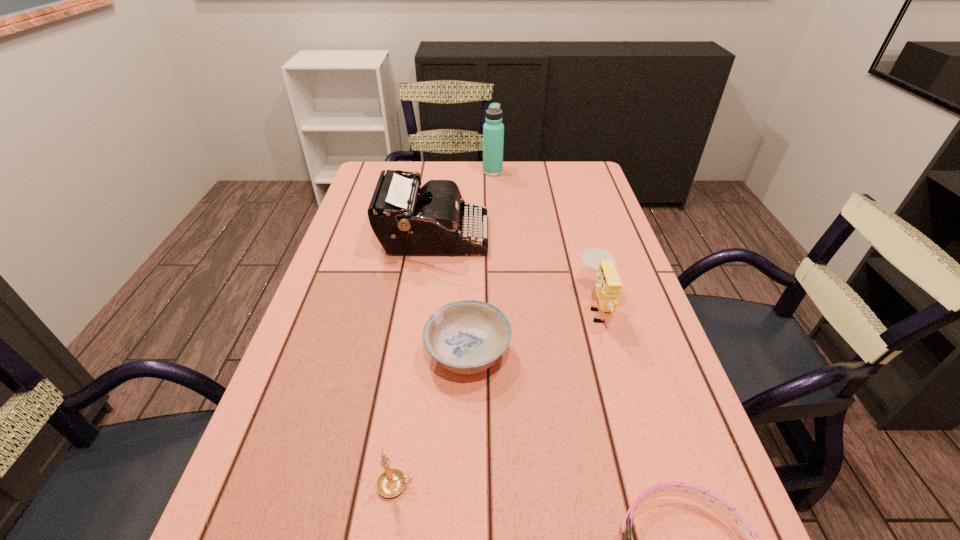
The image size is (960, 540). Identify the location of free location located 0.350m on the front-facing side of the sponge. (430, 307).

The width and height of the screenshot is (960, 540). What are the coordinates of `vacant space located on the handle side of the third shortest object` in the screenshot? It's located at pyautogui.click(x=599, y=485).

Where is `vacant space positioned 0.050m on the left of the fifth tallest object`? This screenshot has height=540, width=960. vacant space positioned 0.050m on the left of the fifth tallest object is located at coordinates (401, 354).

Find the location of a particular element. object that is at the far edge is located at coordinates (493, 130).

Locate an element on the screen. object that is at the left edge is located at coordinates (407, 220).

Where is `object that is positioned at the right edge`? object that is positioned at the right edge is located at coordinates (608, 286).

At what (x,y) coordinates should I click in order to perform the action: click on free space at the far edge of the desktop. Please return your answer as a coordinate pair (x, y). This screenshot has height=540, width=960. Looking at the image, I should click on (461, 178).

You are a GUI agent. You are given a task and a screenshot of the screen. Output one action in this format:
    pyautogui.click(x=<x>, y=<y>)
    Task: Click on the vacant space at the left edge of the desktop
    Image resolution: width=960 pixels, height=540 pixels.
    Given the screenshot: What is the action you would take?
    pyautogui.click(x=361, y=224)

Where is `vacant space at the right edge`? Image resolution: width=960 pixels, height=540 pixels. vacant space at the right edge is located at coordinates (579, 221).

The width and height of the screenshot is (960, 540). In order to click on free space that is in between the typewriter and the bowl in this screenshot , I will do coord(451,295).